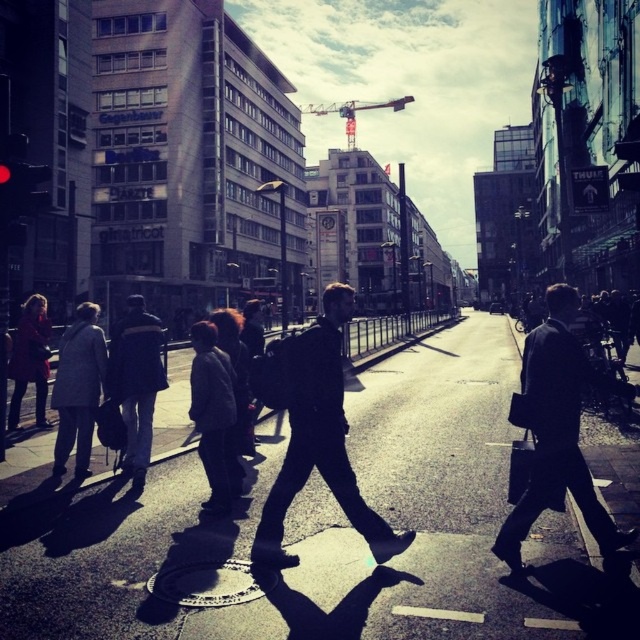
You are a delivery person standing on the sidewalk. You need to deliver a package to a person wearing a dark suit at center and another to someone in a dark gray jacket at center. The delivery robot you have can only carry one package at a time and has a maximum reach of 12 feet. Can the robot deliver both packages without moving its position?

The dark suit at center and dark gray jacket at center are 13.13 feet apart from each other. Since the robot can only reach up to 12 feet, it cannot deliver both packages without moving because the distance between them exceeds its maximum reach.

You are standing at the point with coordinates point (72, 397) and want to walk towards the point with coordinates point (291, 385). Which direction should you move relative to the street?

You should move towards the point (291, 385), which is in front of point (72, 397). Since the perspective is from a pedestrian viewpoint looking down the street, moving towards the point in front would mean walking forward along the street towards the direction the street extends into the distance.